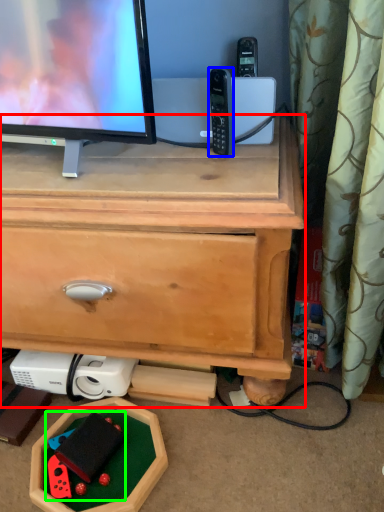
Question: Based on their relative distances, which object is farther from chest of drawers (highlighted by a red box)? Choose from gadget (highlighted by a blue box) and toy (highlighted by a green box).

Choices:
 (A) gadget
 (B) toy

Answer: (B)